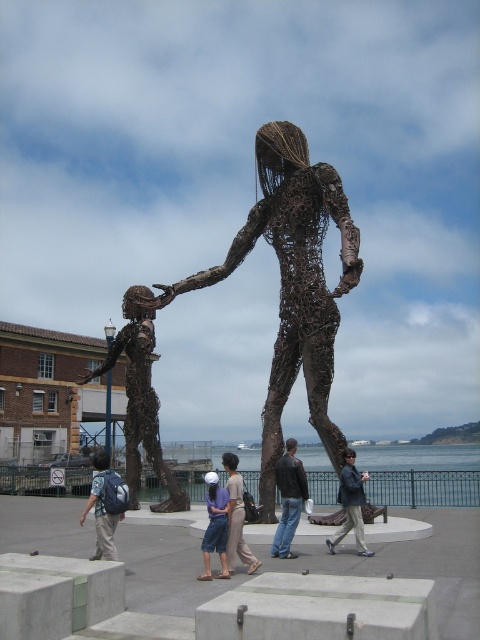
Who is lower down, brown wire sculpture at left or dark brown leather jacket at center?

brown wire sculpture at left

Is brown wire sculpture at left to the right of dark brown leather jacket at center from the viewer's perspective?

In fact, brown wire sculpture at left is to the left of dark brown leather jacket at center.

Is point (136, 358) positioned behind point (345, 532)?

Yes, it is behind point (345, 532).

Find the location of a particular element. This screenshot has width=480, height=640. brown wire sculpture at left is located at coordinates (141, 397).

Is dark brown leather jacket at center to the right of denim shorts at center from the viewer's perspective?

Correct, you'll find dark brown leather jacket at center to the right of denim shorts at center.

Can you confirm if dark brown leather jacket at center is smaller than denim shorts at center?

No.

Does point (343, 496) come farther from viewer compared to point (216, 524)?

That is True.

At what (x,y) coordinates should I click in order to perform the action: click on dark brown leather jacket at center. Please return your answer as a coordinate pair (x, y). The image size is (480, 640). Looking at the image, I should click on (350, 504).

Which is behind, point (288, 355) or point (346, 529)?

Positioned behind is point (288, 355).

Does point (279, 244) come in front of point (346, 464)?

No, it is behind (346, 464).

What are the coordinates of `bronze wireframe figure at center` in the screenshot? It's located at (292, 284).